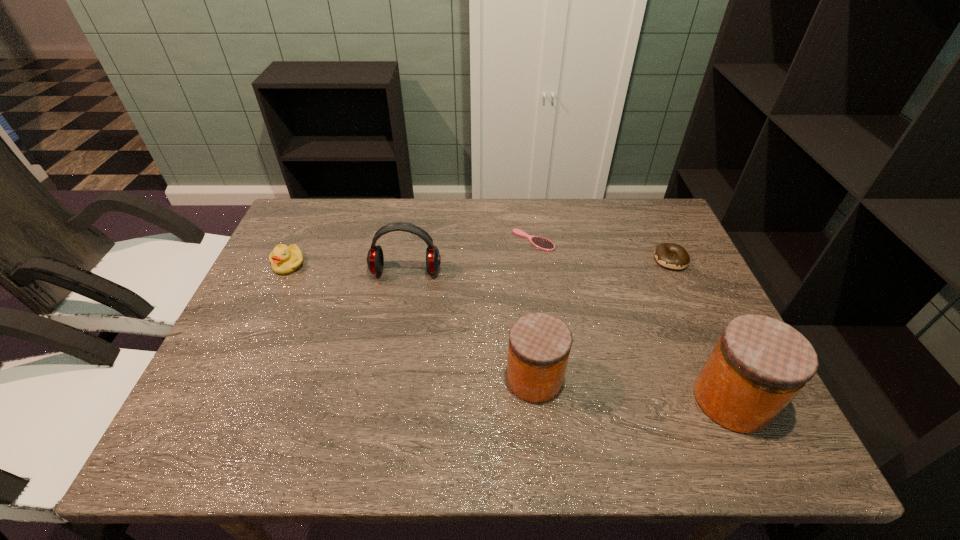
This screenshot has width=960, height=540. What are the coordinates of `vacant area that lies between the shorter jar and the second object from left to right` in the screenshot? It's located at (470, 325).

Locate an element on the screen. vacant space that's between the earphone and the hairbrush is located at coordinates (469, 256).

This screenshot has height=540, width=960. What are the coordinates of `blank region between the second shortest object and the shortest object` in the screenshot? It's located at (602, 250).

Find the location of `empty space between the left jar and the third shortest object`. empty space between the left jar and the third shortest object is located at coordinates (412, 321).

Identify which object is the third closest to the left jar. Please provide its 2D coordinates. Your answer should be formatted as a tuple, i.e. [(x, y)], where the tuple contains the x and y coordinates of a point satisfying the conditions above.

[(541, 243)]

Select which object appears as the second closest to the left jar. Please provide its 2D coordinates. Your answer should be formatted as a tuple, i.e. [(x, y)], where the tuple contains the x and y coordinates of a point satisfying the conditions above.

[(375, 260)]

The image size is (960, 540). Find the location of `free space that satisfies the following two spatial constraints: 1. at the face of the left jar; 2. on the left side of the leftmost object`. free space that satisfies the following two spatial constraints: 1. at the face of the left jar; 2. on the left side of the leftmost object is located at coordinates (236, 379).

Where is `vacant region that satisfies the following two spatial constraints: 1. on the back side of the hairbrush; 2. on the left side of the left jar`? The width and height of the screenshot is (960, 540). vacant region that satisfies the following two spatial constraints: 1. on the back side of the hairbrush; 2. on the left side of the left jar is located at coordinates (520, 240).

At what (x,y) coordinates should I click in order to perform the action: click on vacant area in the image that satisfies the following two spatial constraints: 1. at the face of the right jar; 2. on the right side of the duckling. Please return your answer as a coordinate pair (x, y). The height and width of the screenshot is (540, 960). Looking at the image, I should click on (226, 400).